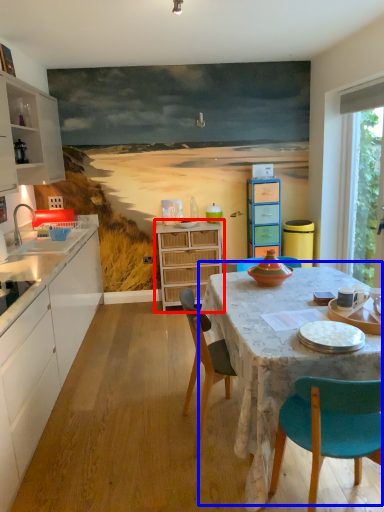
Question: Among these objects, which one is farthest to the camera, chest of drawers (highlighted by a red box) or kitchen & dining room table (highlighted by a blue box)?

Choices:
 (A) chest of drawers
 (B) kitchen & dining room table

Answer: (A)